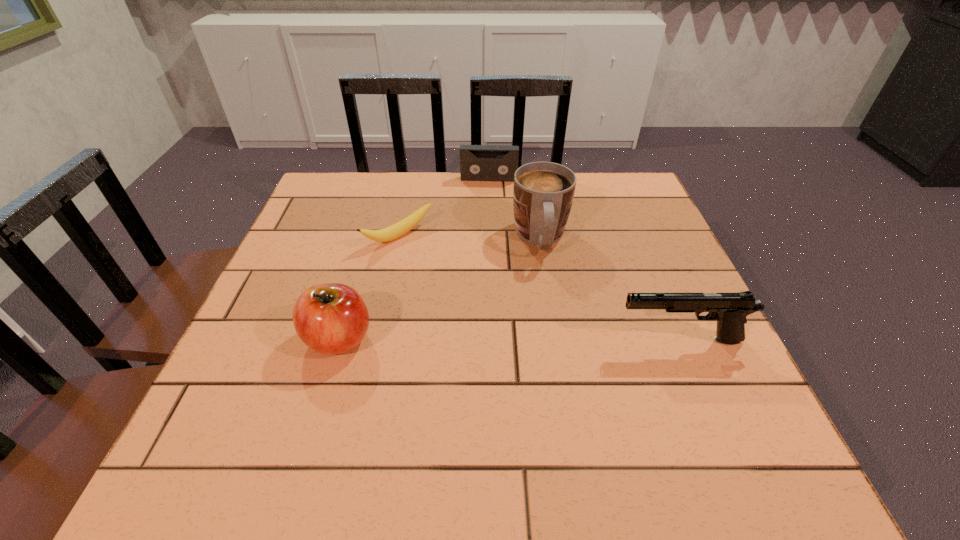
Where is `blank space at the far right corner of the desktop`? The image size is (960, 540). blank space at the far right corner of the desktop is located at coordinates (618, 190).

Identify the location of vacant space in between the apple and the farthest object. (414, 259).

Where is `vacant area that lies between the shortest object and the apple`? The height and width of the screenshot is (540, 960). vacant area that lies between the shortest object and the apple is located at coordinates (369, 287).

The image size is (960, 540). Find the location of `free point between the mug and the apple`. free point between the mug and the apple is located at coordinates (440, 289).

The width and height of the screenshot is (960, 540). I want to click on vacant area that lies between the mug and the rightmost object, so click(610, 289).

Locate an element on the screen. This screenshot has height=540, width=960. empty space between the apple and the rightmost object is located at coordinates (509, 340).

At what (x,y) coordinates should I click in order to perform the action: click on unoccupied area between the second shortest object and the apple. Please return your answer as a coordinate pair (x, y). Image resolution: width=960 pixels, height=540 pixels. Looking at the image, I should click on (414, 259).

What are the coordinates of `free space between the gun and the apple` in the screenshot? It's located at (509, 340).

At what (x,y) coordinates should I click in order to perform the action: click on vacant space that is in between the banana and the gun. Please return your answer as a coordinate pair (x, y). Looking at the image, I should click on (540, 288).

Find the location of a particular element. The width and height of the screenshot is (960, 540). unoccupied position between the gun and the apple is located at coordinates (509, 340).